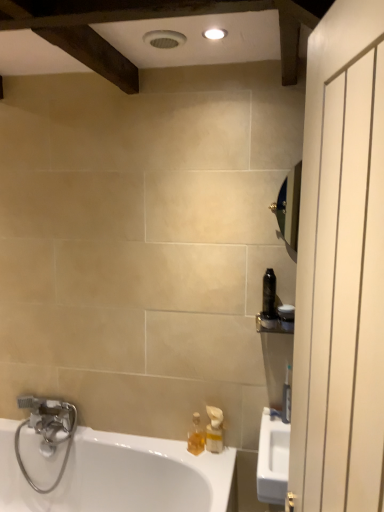
Locate an element on the screen. This screenshot has width=384, height=512. free space to the left of translucent plastic soap dispenser at lower center, arranged as the first soap dispenser when viewed from the left is located at coordinates (170, 449).